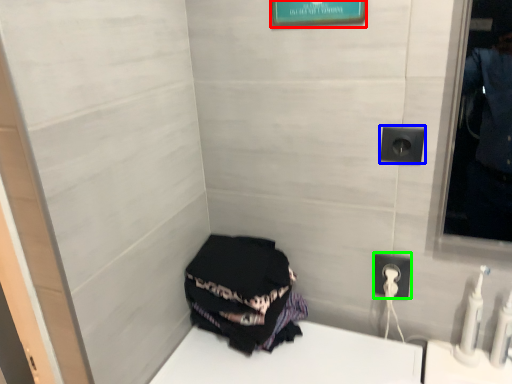
Question: Considering the real-world distances, which object is farthest from picture frame (highlighted by a red box)? electric outlet (highlighted by a blue box) or power outlet (highlighted by a green box)?

Choices:
 (A) electric outlet
 (B) power outlet

Answer: (B)